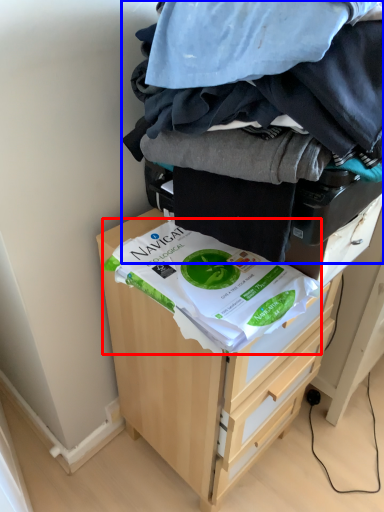
Question: Among these objects, which one is nearest to the camera, food (highlighted by a red box) or laundry (highlighted by a blue box)?

Choices:
 (A) food
 (B) laundry

Answer: (B)